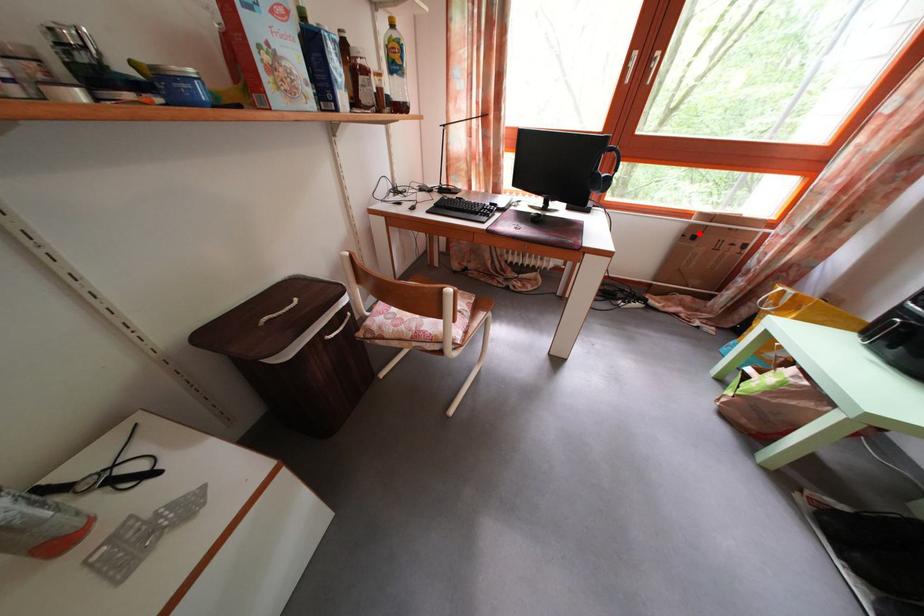
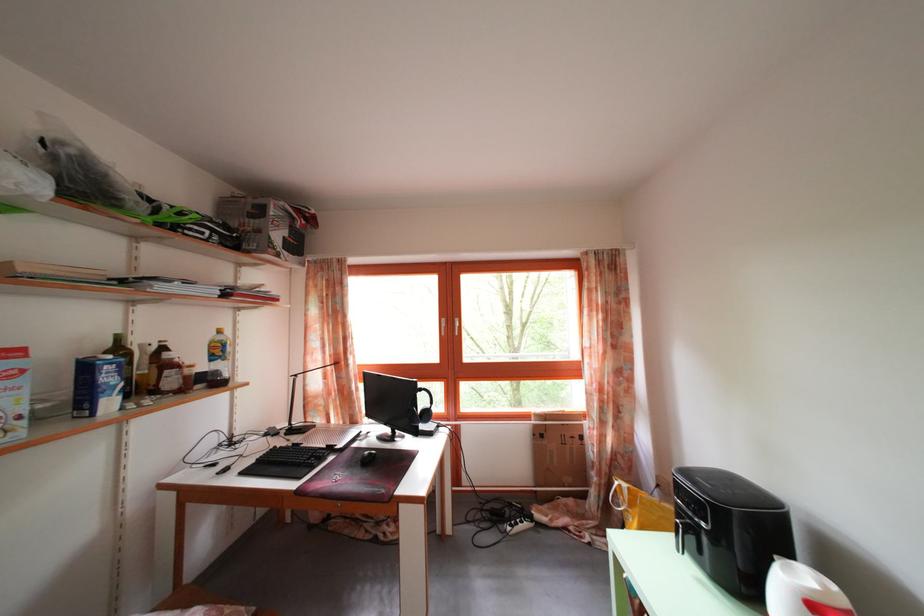
Question: I am providing you with two images of the same scene from different viewpoints. Image1 has a red point marked. In image2, the corresponding 3D location appears at what relative position? Reply with the corresponding letter.

Choices:
 (A) Closer
 (B) Farther

Answer: (B)